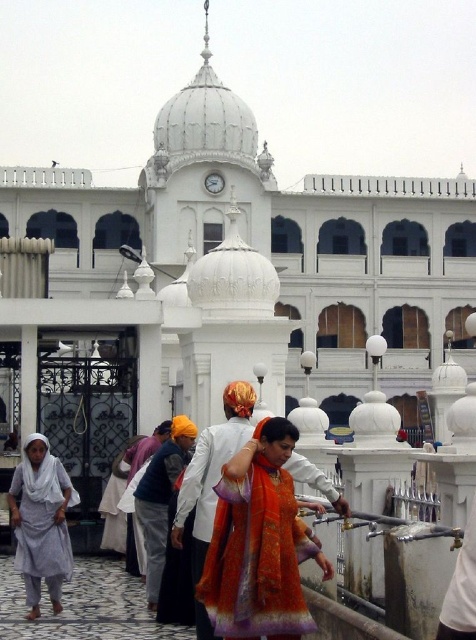
Is point (221, 515) more distant than point (22, 564)?

That is False.

Does point (240, 499) come closer to viewer compared to point (47, 465)?

Yes.

What do you see at coordinates (258, 544) in the screenshot? I see `orange silk saree at center` at bounding box center [258, 544].

Locate an element on the screen. Image resolution: width=476 pixels, height=640 pixels. orange silk saree at center is located at coordinates (258, 544).

Does light gray cotton dress at lower left have a larger size compared to orange silk robe at center?

No.

Find the location of a particular element. The image size is (476, 640). light gray cotton dress at lower left is located at coordinates (41, 522).

Does point (228, 616) come behind point (144, 500)?

No, it is in front of (144, 500).

Does point (277, 548) lie in front of point (158, 579)?

Yes.

Is point (250, 556) positioned behind point (188, 438)?

No, (250, 556) is in front of (188, 438).

Where is `orange silk saree at center`? orange silk saree at center is located at coordinates (258, 544).